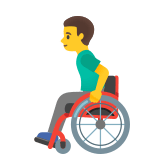
The height and width of the screenshot is (160, 160). Find the location of `foot rest`. foot rest is located at coordinates (47, 141).